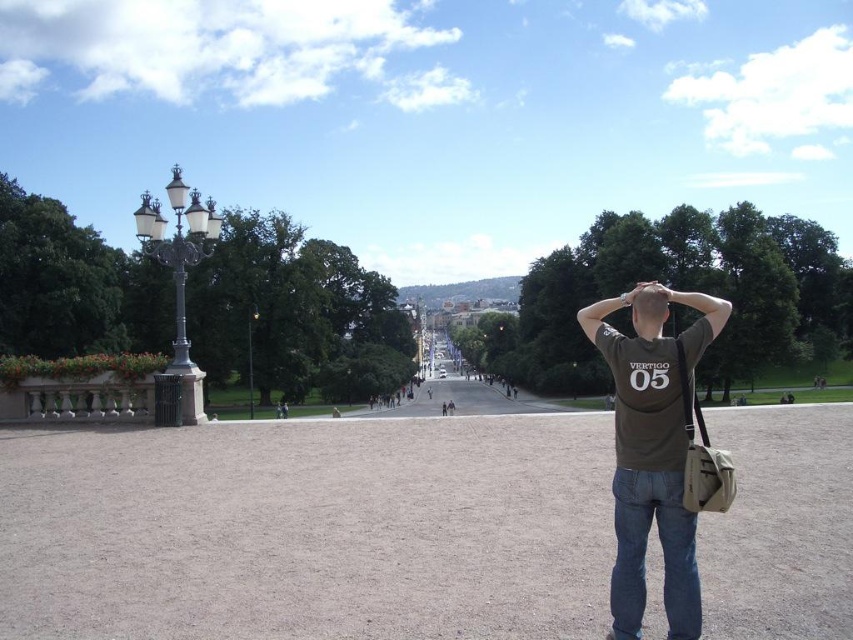
Question: Which point is farther to the camera?

Choices:
 (A) (637, 321)
 (B) (187, 253)

Answer: (B)

Question: Is brown hair at upper center below polished brass lamp post at left?

Choices:
 (A) no
 (B) yes

Answer: (A)

Question: From the image, what is the correct spatial relationship of dark green t-shirt at upper right in relation to polished brass lamp post at left?

Choices:
 (A) above
 (B) below

Answer: (A)

Question: Does brown hair at upper center appear under polished brass lamp post at left?

Choices:
 (A) no
 (B) yes

Answer: (A)

Question: Considering the real-world distances, which object is farthest from the polished brass lamp post at left?

Choices:
 (A) dark green t-shirt at upper right
 (B) brown hair at upper center
 (C) polished brass streetlamp at left

Answer: (A)

Question: Which of these objects is positioned farthest from the polished brass lamp post at left?

Choices:
 (A) dark green t-shirt at upper right
 (B) polished brass streetlamp at left
 (C) brown hair at upper center

Answer: (A)